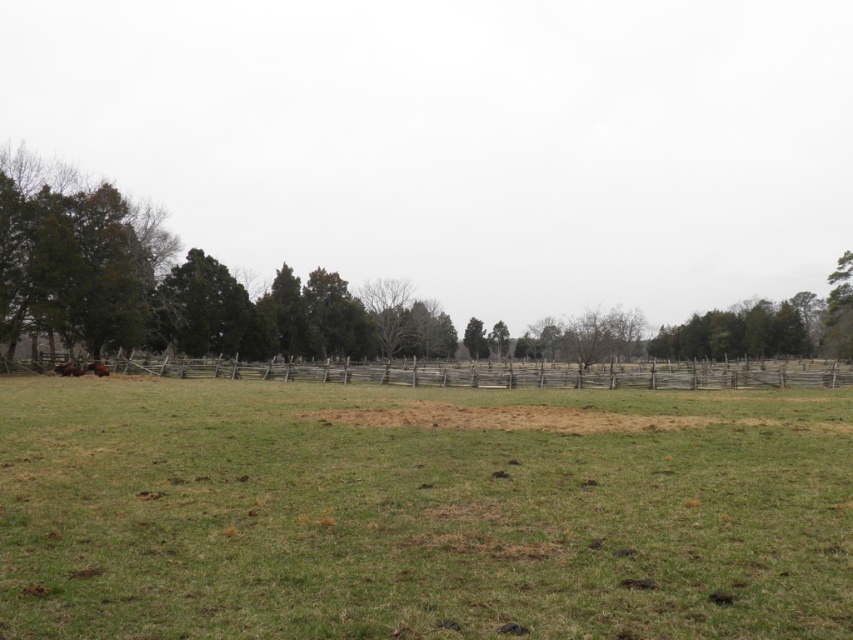
Question: Is green leafy tree at left closer to camera compared to brown fuzzy cow at lower left?

Choices:
 (A) yes
 (B) no

Answer: (A)

Question: Which point is closer to the camera?

Choices:
 (A) green leafy tree at left
 (B) green grassy field at center
 (C) brown fuzzy cow at lower left

Answer: (B)

Question: Does weathered wood fence at center have a lesser width compared to brown furry cow at lower left?

Choices:
 (A) yes
 (B) no

Answer: (B)

Question: Which point is farther to the camera?

Choices:
 (A) (62, 365)
 (B) (97, 364)

Answer: (B)

Question: Where is weathered wood fence at center located in relation to brown furry cow at lower left in the image?

Choices:
 (A) left
 (B) right

Answer: (B)

Question: Which point is farther from the camera taking this photo?

Choices:
 (A) (91, 371)
 (B) (844, 256)

Answer: (B)